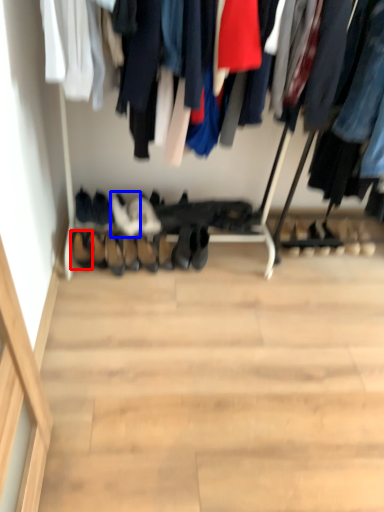
Question: Which object appears farthest to the camera in this image, shoe (highlighted by a red box) or footwear (highlighted by a blue box)?

Choices:
 (A) shoe
 (B) footwear

Answer: (B)